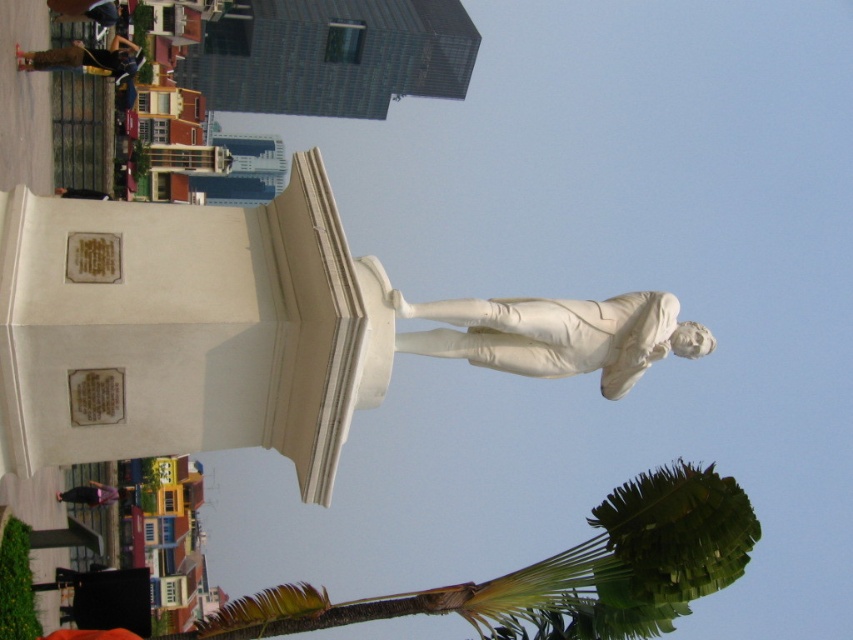
You are a city planner assessing the statue and the palm tree in the image. Which object is taller, the green leafy palm at lower right or the white marble statue at center?

The green leafy palm at lower right is taller than the white marble statue at center according to the description.

You are a photographer setting up a shot of the statue. You want to include both the green leafy palm at lower right and the matte black jacket at upper left in your frame. Which object should you position to the right side of your camera viewfinder?

The green leafy palm at lower right should be positioned to the right side of your camera viewfinder because it is located to the right of the matte black jacket at upper left.

You are a photographer trying to capture the white marble statue at center without any obstructions. You notice the green leafy palm at lower right in the frame. Based on their sizes, do you think the palm will block the statue in your photo?

The green leafy palm at lower right might be wider than the white marble statue at center, so there is a possibility that the palm could block the statue in the photo if not positioned carefully.